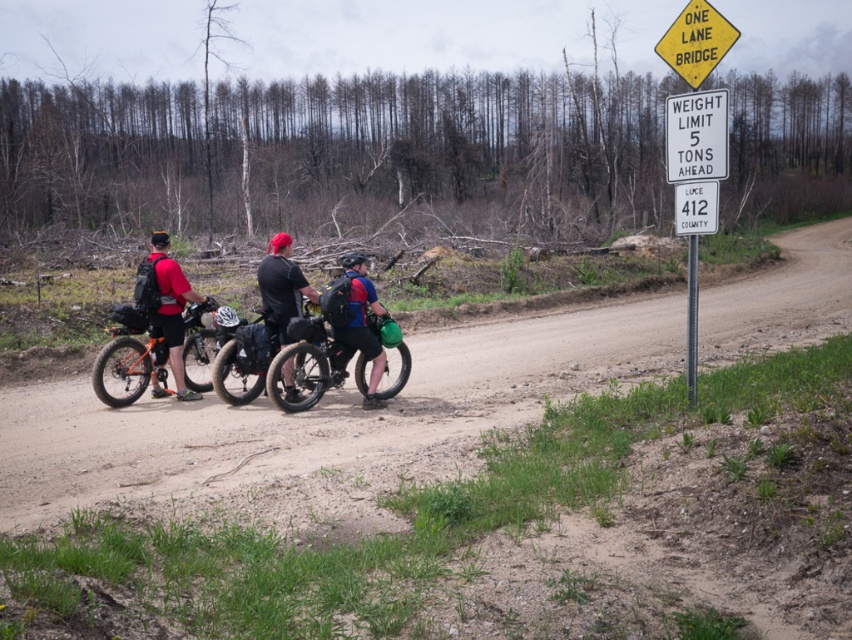
Is point (714, 104) positioned behind point (274, 330)?

That is False.

Does yellow plastic sign at upper right appear on the left side of black matte shirt at center?

Incorrect, yellow plastic sign at upper right is not on the left side of black matte shirt at center.

Locate an element on the screen. yellow plastic sign at upper right is located at coordinates (695, 134).

The width and height of the screenshot is (852, 640). What are the coordinates of `yellow plastic sign at upper right` in the screenshot? It's located at (695, 134).

Does matte black bicycle at center lie in front of yellow plastic sign at upper right?

No.

Is matte black bicycle at center smaller than yellow plastic sign at upper right?

Yes.

Which is in front, point (363, 394) or point (699, 156)?

Positioned in front is point (699, 156).

Locate an element on the screen. Image resolution: width=852 pixels, height=640 pixels. matte black bicycle at center is located at coordinates (314, 364).

Where is `matte black backpack at left`? This screenshot has width=852, height=640. matte black backpack at left is located at coordinates click(165, 305).

Is matte black backpack at left wider than black matte shirt at center?

No.

Is point (162, 300) closer to viewer compared to point (289, 301)?

Yes, it is.

Find the location of a particular element. This screenshot has width=852, height=640. matte black backpack at left is located at coordinates (165, 305).